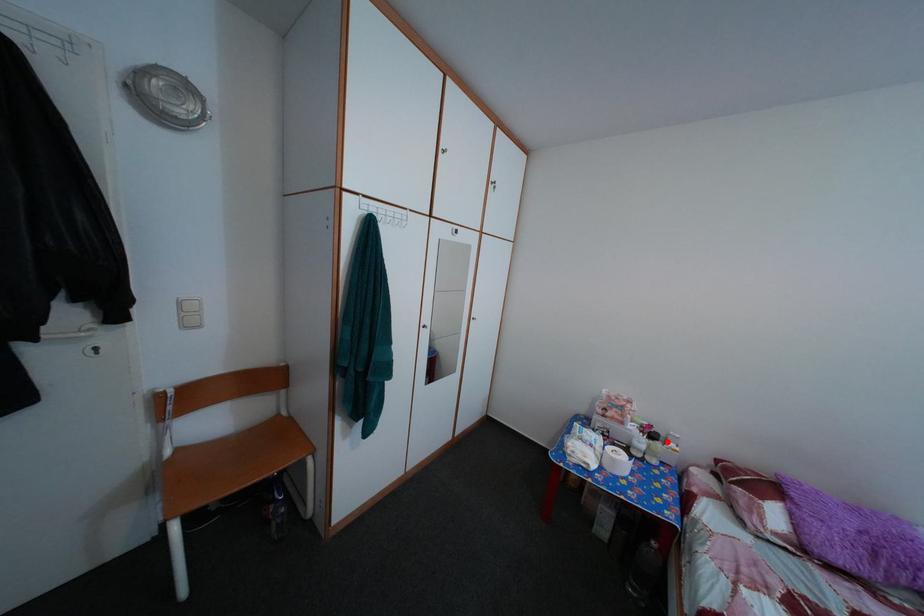
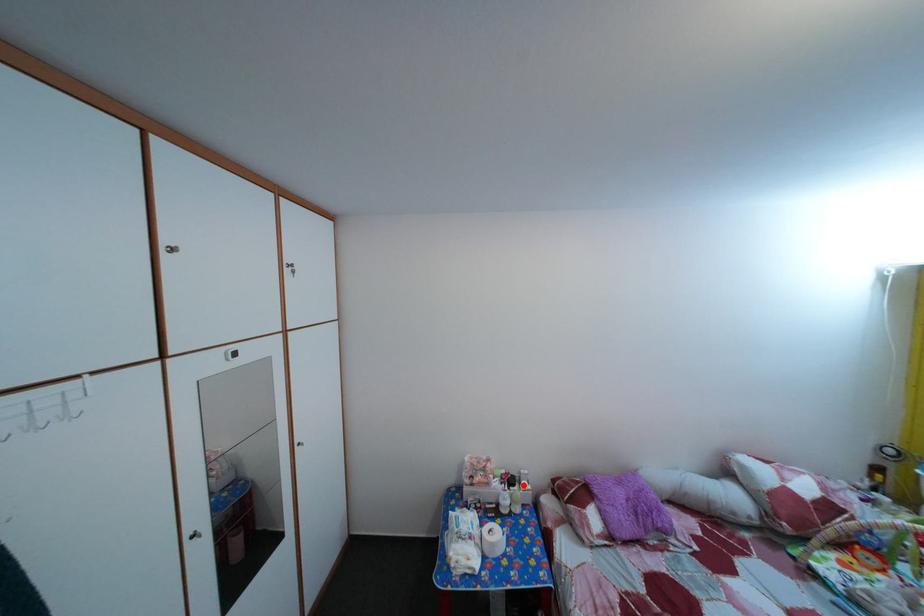
I am providing you with two images of the same scene from different viewpoints. A red point is marked on the first image and another point is marked on the second image. Is the marked point in image1 the same physical position as the marked point in image2?

Yes